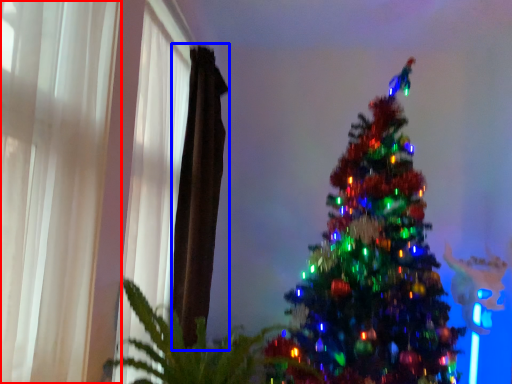
Question: Among these objects, which one is farthest to the camera, curtain (highlighted by a red box) or curtain (highlighted by a blue box)?

Choices:
 (A) curtain
 (B) curtain

Answer: (B)